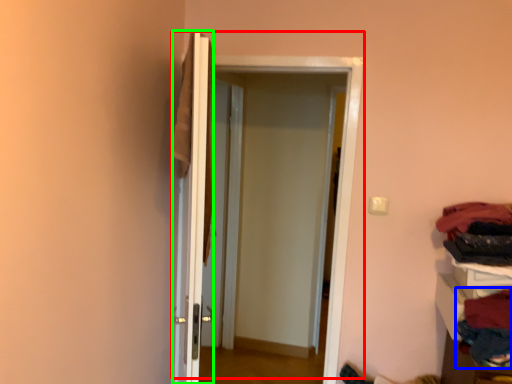
Question: Which object is the closest to the door (highlighted by a red box)? Choose among these: clothing (highlighted by a blue box) or door (highlighted by a green box).

Choices:
 (A) clothing
 (B) door

Answer: (B)